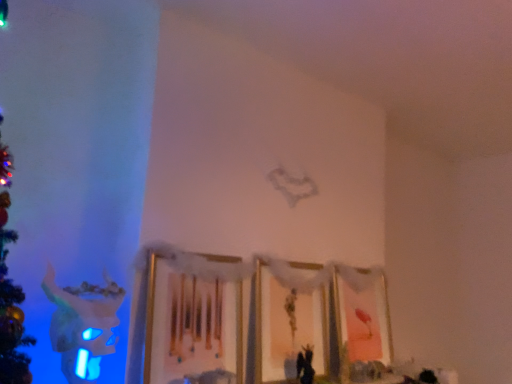
I want to click on matte gold picture frame at center, the 2th picture frame when ordered from right to left, so click(289, 316).

What is the approximate width of wooden picture frame at center, placed as the first picture frame when sorted from left to right?

It is 3.79 inches.

Where is `pink matte picture frame at lower right, acting as the first picture frame starting from the right`? This screenshot has width=512, height=384. pink matte picture frame at lower right, acting as the first picture frame starting from the right is located at coordinates (364, 314).

Could wooden picture frame at center, placed as the first picture frame when sorted from left to right, be considered to be inside matte gold picture frame at center, the 2th picture frame when ordered from right to left?

No.

From the image's perspective, is matte gold picture frame at center, placed as the second picture frame when sorted from left to right, beneath wooden picture frame at center, placed as the first picture frame when sorted from left to right?

Indeed, from the image's perspective, matte gold picture frame at center, placed as the second picture frame when sorted from left to right, is shown beneath wooden picture frame at center, placed as the first picture frame when sorted from left to right.

Does point (285, 349) appear closer or farther from the camera than point (233, 264)?

Point (285, 349) appears to be farther away from the viewer than point (233, 264).

There is a pink matte picture frame at lower right, acting as the first picture frame starting from the right. At what (x,y) coordinates should I click in order to perform the action: click on the 1st picture frame above it (from the image's perspective). Please return your answer as a coordinate pair (x, y). Image resolution: width=512 pixels, height=384 pixels. Looking at the image, I should click on point(289,316).

Can you confirm if pink matte picture frame at lower right, the third picture frame from the left, is positioned to the right of matte gold picture frame at center, placed as the second picture frame when sorted from left to right?

Yes, pink matte picture frame at lower right, the third picture frame from the left, is to the right of matte gold picture frame at center, placed as the second picture frame when sorted from left to right.

Can you confirm if pink matte picture frame at lower right, the third picture frame from the left, is bigger than matte gold picture frame at center, the 2th picture frame when ordered from right to left?

Indeed, pink matte picture frame at lower right, the third picture frame from the left, has a larger size compared to matte gold picture frame at center, the 2th picture frame when ordered from right to left.

Is pink matte picture frame at lower right, acting as the first picture frame starting from the right, bigger or smaller than wooden picture frame at center, placed as the first picture frame when sorted from left to right?

Considering their sizes, pink matte picture frame at lower right, acting as the first picture frame starting from the right, takes up more space than wooden picture frame at center, placed as the first picture frame when sorted from left to right.

Consider the image. Between pink matte picture frame at lower right, the third picture frame from the left, and wooden picture frame at center, which is counted as the third picture frame, starting from the right, which one has larger width?

With larger width is pink matte picture frame at lower right, the third picture frame from the left.

Looking at this image, considering the relative positions of pink matte picture frame at lower right, acting as the first picture frame starting from the right, and wooden picture frame at center, which is counted as the third picture frame, starting from the right, in the image provided, is pink matte picture frame at lower right, acting as the first picture frame starting from the right, behind wooden picture frame at center, which is counted as the third picture frame, starting from the right,?

Yes, pink matte picture frame at lower right, acting as the first picture frame starting from the right, is further from the viewer.

Is pink matte picture frame at lower right, acting as the first picture frame starting from the right, taller or shorter than wooden picture frame at center, placed as the first picture frame when sorted from left to right?

In the image, pink matte picture frame at lower right, acting as the first picture frame starting from the right, appears to be taller than wooden picture frame at center, placed as the first picture frame when sorted from left to right.

Considering the sizes of wooden picture frame at center, placed as the first picture frame when sorted from left to right, and pink matte picture frame at lower right, the third picture frame from the left, in the image, is wooden picture frame at center, placed as the first picture frame when sorted from left to right, taller or shorter than pink matte picture frame at lower right, the third picture frame from the left,?

wooden picture frame at center, placed as the first picture frame when sorted from left to right, is shorter than pink matte picture frame at lower right, the third picture frame from the left.

Looking at this image, in the image, is wooden picture frame at center, which is counted as the third picture frame, starting from the right, positioned in front of or behind pink matte picture frame at lower right, the third picture frame from the left?

In the image, wooden picture frame at center, which is counted as the third picture frame, starting from the right, appears in front of pink matte picture frame at lower right, the third picture frame from the left.

Is point (240, 373) farther from camera compared to point (351, 349)?

No.

Considering the relative sizes of matte gold picture frame at center, placed as the second picture frame when sorted from left to right, and pink matte picture frame at lower right, acting as the first picture frame starting from the right, in the image provided, is matte gold picture frame at center, placed as the second picture frame when sorted from left to right, wider than pink matte picture frame at lower right, acting as the first picture frame starting from the right,?

In fact, matte gold picture frame at center, placed as the second picture frame when sorted from left to right, might be narrower than pink matte picture frame at lower right, acting as the first picture frame starting from the right.

From the image's perspective, between matte gold picture frame at center, the 2th picture frame when ordered from right to left, and pink matte picture frame at lower right, acting as the first picture frame starting from the right, who is located below?

pink matte picture frame at lower right, acting as the first picture frame starting from the right.

Is point (317, 329) positioned before point (360, 301)?

Yes, point (317, 329) is closer to viewer.

From the image's perspective, between wooden picture frame at center, which is counted as the third picture frame, starting from the right, and matte gold picture frame at center, placed as the second picture frame when sorted from left to right, which one is located above?

wooden picture frame at center, which is counted as the third picture frame, starting from the right, from the image's perspective.

From a real-world perspective, between wooden picture frame at center, placed as the first picture frame when sorted from left to right, and matte gold picture frame at center, the 2th picture frame when ordered from right to left, who is vertically lower?

matte gold picture frame at center, the 2th picture frame when ordered from right to left.

Does point (170, 329) appear closer or farther from the camera than point (281, 369)?

Point (170, 329) is closer to the camera than point (281, 369).

Is wooden picture frame at center, which is counted as the third picture frame, starting from the right, facing towards matte gold picture frame at center, placed as the second picture frame when sorted from left to right?

No, wooden picture frame at center, which is counted as the third picture frame, starting from the right, is not facing towards matte gold picture frame at center, placed as the second picture frame when sorted from left to right.

Where is `the 1st picture frame positioned below the wooden picture frame at center, which is counted as the third picture frame, starting from the right (from the image's perspective)`? the 1st picture frame positioned below the wooden picture frame at center, which is counted as the third picture frame, starting from the right (from the image's perspective) is located at coordinates (289, 316).

Identify the location of the 1st picture frame directly above the pink matte picture frame at lower right, the third picture frame from the left (from a real-world perspective). (289, 316).

Which object lies nearer to the anchor point matte gold picture frame at center, the 2th picture frame when ordered from right to left, wooden picture frame at center, placed as the first picture frame when sorted from left to right, or pink matte picture frame at lower right, the third picture frame from the left?

pink matte picture frame at lower right, the third picture frame from the left.

Based on the photo, estimate the real-world distances between objects in this image. Which object is further from pink matte picture frame at lower right, the third picture frame from the left, wooden picture frame at center, placed as the first picture frame when sorted from left to right, or matte gold picture frame at center, the 2th picture frame when ordered from right to left?

wooden picture frame at center, placed as the first picture frame when sorted from left to right, is positioned further to the anchor pink matte picture frame at lower right, the third picture frame from the left.

Looking at the image, which one is located further to pink matte picture frame at lower right, the third picture frame from the left, matte gold picture frame at center, the 2th picture frame when ordered from right to left, or wooden picture frame at center, placed as the first picture frame when sorted from left to right?

wooden picture frame at center, placed as the first picture frame when sorted from left to right, is further to pink matte picture frame at lower right, the third picture frame from the left.

From the image, which object appears to be nearer to wooden picture frame at center, placed as the first picture frame when sorted from left to right, matte gold picture frame at center, placed as the second picture frame when sorted from left to right, or pink matte picture frame at lower right, the third picture frame from the left?

matte gold picture frame at center, placed as the second picture frame when sorted from left to right, is positioned closer to the anchor wooden picture frame at center, placed as the first picture frame when sorted from left to right.

When comparing their distances from matte gold picture frame at center, the 2th picture frame when ordered from right to left, does pink matte picture frame at lower right, the third picture frame from the left, or wooden picture frame at center, which is counted as the third picture frame, starting from the right, seem further?

wooden picture frame at center, which is counted as the third picture frame, starting from the right, is further to matte gold picture frame at center, the 2th picture frame when ordered from right to left.

In the scene shown: When comparing their distances from wooden picture frame at center, placed as the first picture frame when sorted from left to right, does pink matte picture frame at lower right, the third picture frame from the left, or matte gold picture frame at center, the 2th picture frame when ordered from right to left, seem closer?

matte gold picture frame at center, the 2th picture frame when ordered from right to left, is positioned closer to the anchor wooden picture frame at center, placed as the first picture frame when sorted from left to right.

This screenshot has height=384, width=512. Identify the location of picture frame between wooden picture frame at center, which is counted as the third picture frame, starting from the right, and pink matte picture frame at lower right, the third picture frame from the left, from left to right. 289,316.